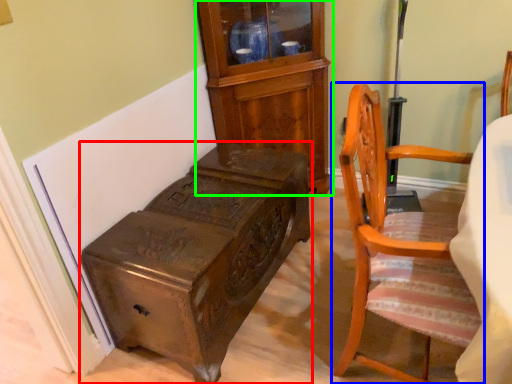
Question: Based on their relative distances, which object is nearer to furniture (highlighted by a red box)? Choose from chair (highlighted by a blue box) and cabinetry (highlighted by a green box).

Choices:
 (A) chair
 (B) cabinetry

Answer: (A)